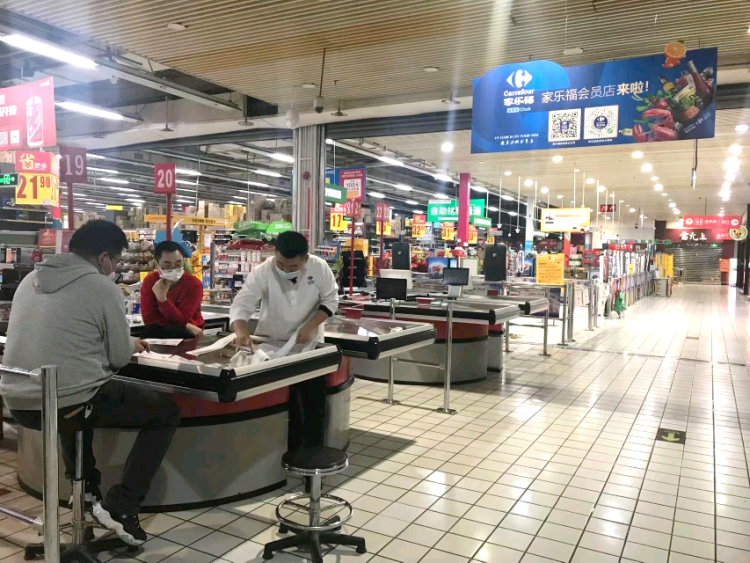
Find the location of a particular element. Image resolution: width=750 pixels, height=563 pixels. ceiling is located at coordinates (112, 168).